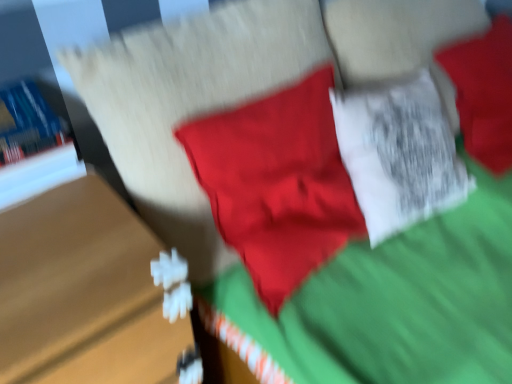
Question: From the image's perspective, is blue hardcover book at left on top of wooden table at left?

Choices:
 (A) yes
 (B) no

Answer: (A)

Question: From a real-world perspective, is blue hardcover book at left physically below wooden table at left?

Choices:
 (A) yes
 (B) no

Answer: (B)

Question: Considering the relative positions of blue hardcover book at left and wooden table at left in the image provided, is blue hardcover book at left to the right of wooden table at left from the viewer's perspective?

Choices:
 (A) no
 (B) yes

Answer: (A)

Question: Considering the relative sizes of blue hardcover book at left and wooden table at left in the image provided, is blue hardcover book at left wider than wooden table at left?

Choices:
 (A) yes
 (B) no

Answer: (B)

Question: Is wooden table at left surrounded by blue hardcover book at left?

Choices:
 (A) yes
 (B) no

Answer: (B)

Question: Considering the relative sizes of blue hardcover book at left and wooden table at left in the image provided, is blue hardcover book at left thinner than wooden table at left?

Choices:
 (A) yes
 (B) no

Answer: (A)

Question: Is wooden table at left looking in the opposite direction of blue hardcover book at left?

Choices:
 (A) yes
 (B) no

Answer: (B)

Question: Is wooden table at left not inside blue hardcover book at left?

Choices:
 (A) yes
 (B) no

Answer: (A)

Question: Is wooden table at left with blue hardcover book at left?

Choices:
 (A) no
 (B) yes

Answer: (A)

Question: Does wooden table at left lie behind blue hardcover book at left?

Choices:
 (A) yes
 (B) no

Answer: (B)

Question: Does wooden table at left have a greater width compared to blue hardcover book at left?

Choices:
 (A) no
 (B) yes

Answer: (B)

Question: Is wooden table at left surrounding blue hardcover book at left?

Choices:
 (A) no
 (B) yes

Answer: (A)

Question: Is wooden table at left in front of or behind blue hardcover book at left in the image?

Choices:
 (A) behind
 (B) front

Answer: (B)